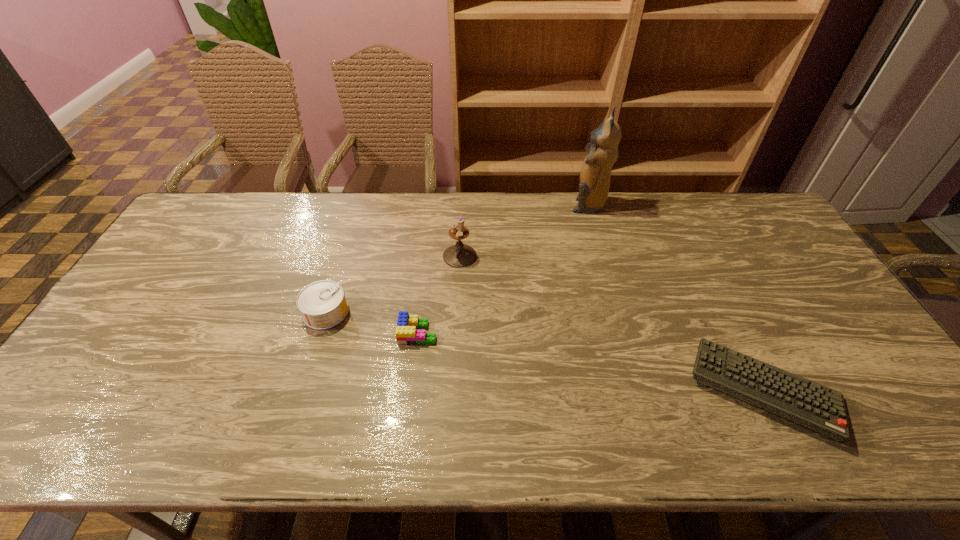
Locate an element on the screen. free point that satisfies the following two spatial constraints: 1. on the face of the second object from right to left; 2. on the front side of the Lego is located at coordinates (623, 333).